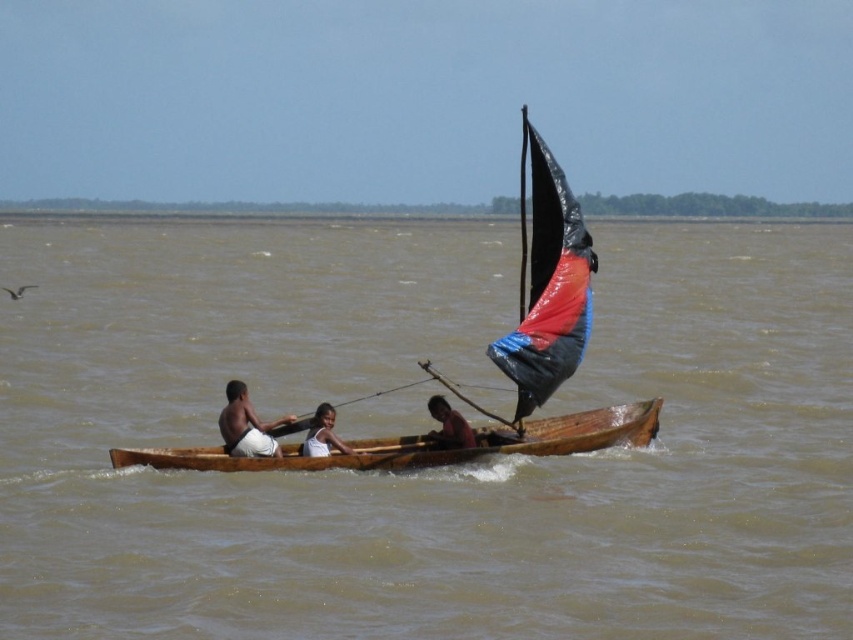
Question: Based on their relative distances, which object is farther from the white fabric shirt at center?

Choices:
 (A) light brown skin at center
 (B) dark skin human at center
 (C) brown muddy water at center

Answer: (C)

Question: Is wooden canoe at center further to the viewer compared to dark skin human at center?

Choices:
 (A) no
 (B) yes

Answer: (A)

Question: Which object appears farthest from the camera in this image?

Choices:
 (A) black plastic sail at upper right
 (B) white fabric shirt at center
 (C) polythene sail at center

Answer: (B)

Question: Which point is farther from the camera taking this photo?

Choices:
 (A) (538, 232)
 (B) (527, 324)

Answer: (A)

Question: Does black plastic sail at upper right appear on the right side of wooden canoe at center?

Choices:
 (A) yes
 (B) no

Answer: (A)

Question: Is black plastic sail at upper right to the right of white fabric shirt at center from the viewer's perspective?

Choices:
 (A) yes
 (B) no

Answer: (A)